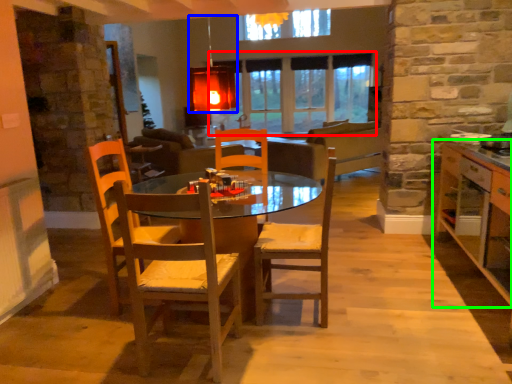
Question: Which object is positioned closest to window (highlighted by a red box)? Select from light fixture (highlighted by a blue box) and cabinetry (highlighted by a green box).

Choices:
 (A) light fixture
 (B) cabinetry

Answer: (B)